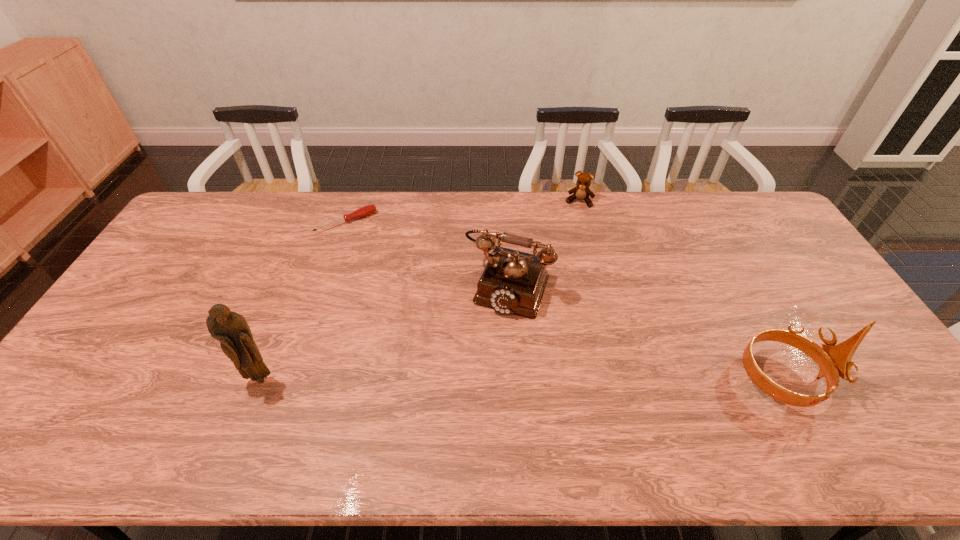
Identify which object is the second nearest to the screwdriver. Please provide its 2D coordinates. Your answer should be formatted as a tuple, i.e. [(x, y)], where the tuple contains the x and y coordinates of a point satisfying the conditions above.

[(230, 328)]

Image resolution: width=960 pixels, height=540 pixels. Find the location of `vacant position in the image that satisfies the following two spatial constraints: 1. on the front-facing side of the tiara; 2. on the front-facing side of the figurine`. vacant position in the image that satisfies the following two spatial constraints: 1. on the front-facing side of the tiara; 2. on the front-facing side of the figurine is located at coordinates (260, 379).

Identify the location of vacant space that satisfies the following two spatial constraints: 1. on the front-facing side of the rightmost object; 2. on the front-facing side of the figurine. This screenshot has height=540, width=960. (260, 379).

Where is `free space that satisfies the following two spatial constraints: 1. on the front side of the shortest object; 2. on the front-facing side of the rightmost object`? free space that satisfies the following two spatial constraints: 1. on the front side of the shortest object; 2. on the front-facing side of the rightmost object is located at coordinates (295, 379).

You are a GUI agent. You are given a task and a screenshot of the screen. Output one action in this format:
    pyautogui.click(x=<x>, y=<y>)
    Task: Click on the free space that satisfies the following two spatial constraints: 1. on the front-facing side of the figurine; 2. on the front-facing side of the rightmost object
    
    Given the screenshot: What is the action you would take?
    pyautogui.click(x=260, y=379)

Identify the location of free spot that satisfies the following two spatial constraints: 1. on the front-facing side of the tallest object; 2. on the front-facing side of the tiara. click(260, 379).

Identify the location of free point that satisfies the following two spatial constraints: 1. on the front-facing side of the tallest object; 2. on the front-facing side of the rightmost object. (260, 379).